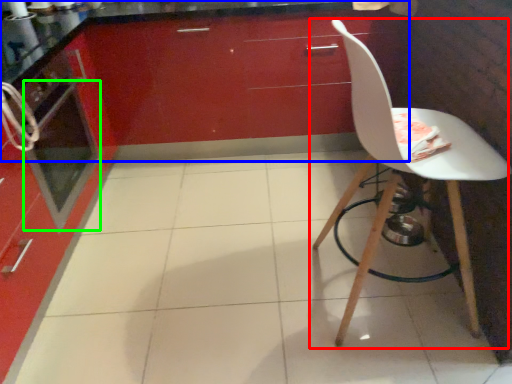
Question: Which is farther away from chair (highlighted by a red box)? cabinetry (highlighted by a blue box) or oven (highlighted by a green box)?

Choices:
 (A) cabinetry
 (B) oven

Answer: (B)